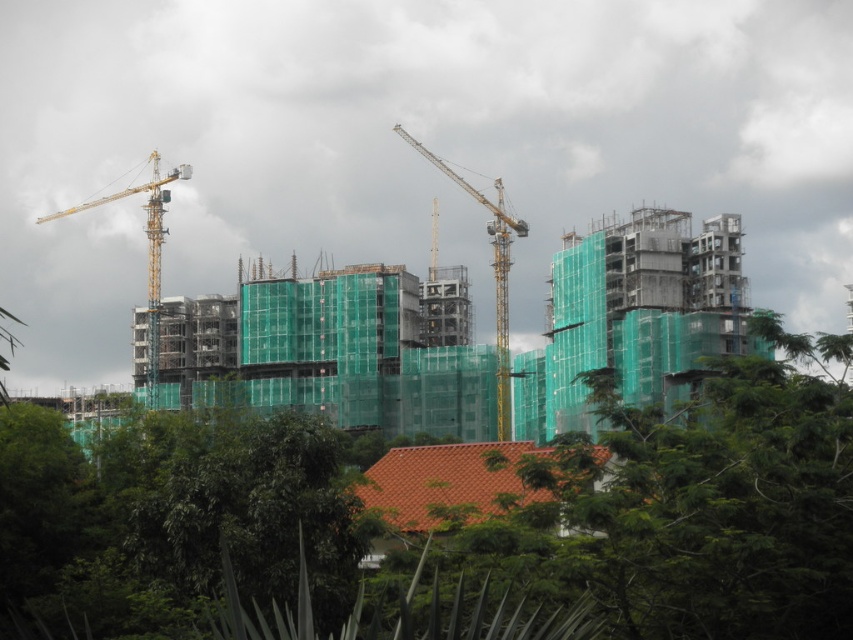
You are a construction worker who needs to move a heavy beam from the ground to the second floor of the building. The beam is currently near the green leafy tree at center. The crane operator is at the yellow metallic crane at left. Can the crane operator lift the beam directly without moving the beam first?

The green leafy tree at center is located below the yellow metallic crane at left, so the crane operator can likely lift the beam directly since the beam is already positioned under the crane.

You are a construction worker standing at the base of the crane on the left side of the image. You need to move to a point that is directly in front of you. Which of the two points, point (850, 522) or point (451, 172), is closer to your current position?

Point (850, 522) is closer to your current position because it is in front of point (451, 172).

You are a construction worker standing at the back of the construction site. You need to move a heavy beam from the ground to the top floor of the building. Which crane, the yellow metallic crane at center or the yellow metallic crane at left, would be better suited for this task based on their positions?

The yellow metallic crane at left is better suited for lifting the heavy beam to the top floor because it is positioned higher than the yellow metallic crane at center, which is located below it.